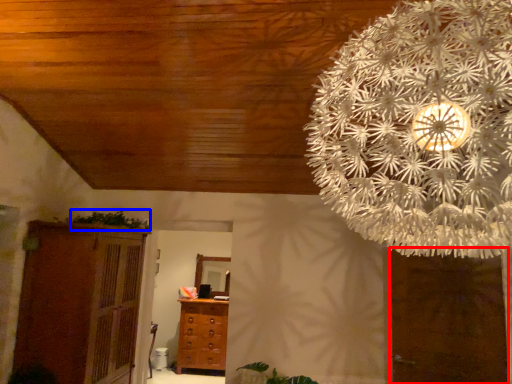
Question: Which object appears farthest to the camera in this image, door (highlighted by a red box) or plant (highlighted by a blue box)?

Choices:
 (A) door
 (B) plant

Answer: (B)